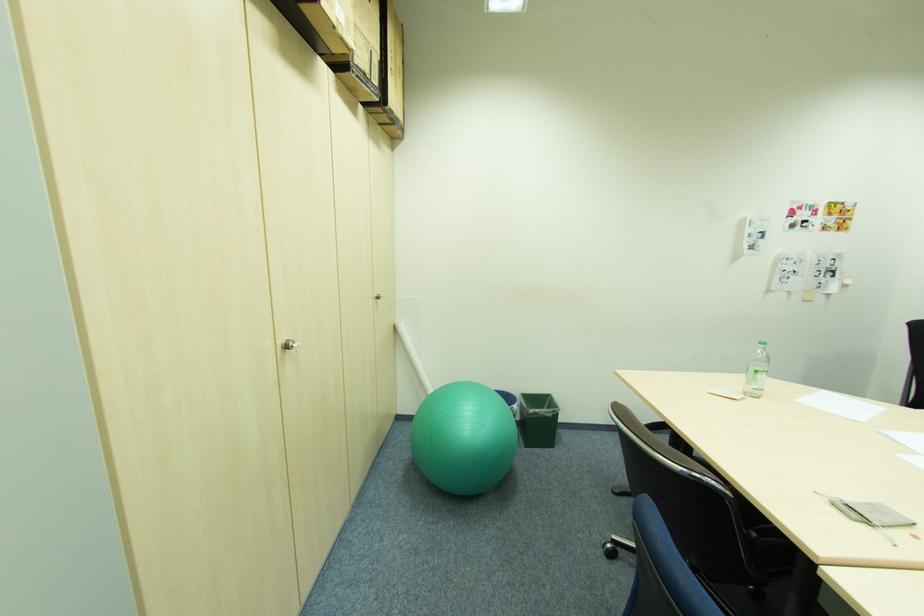
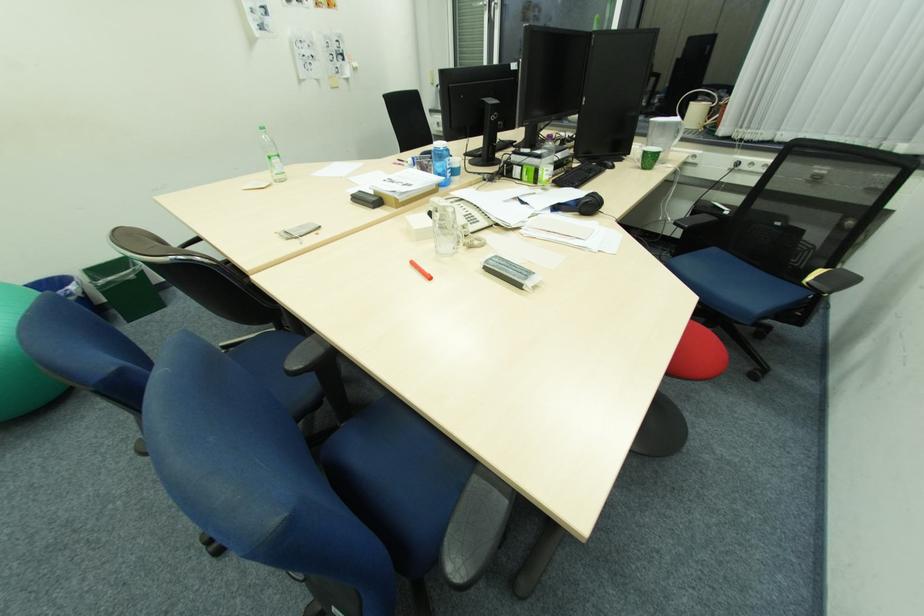
Where in the second image is the point corresponding to (x=541, y=414) from the first image?

(115, 284)